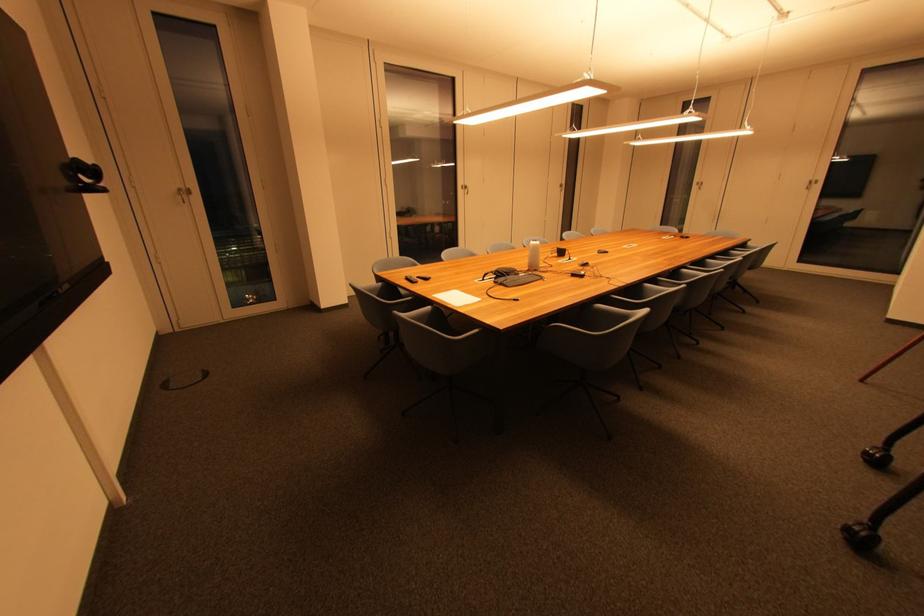
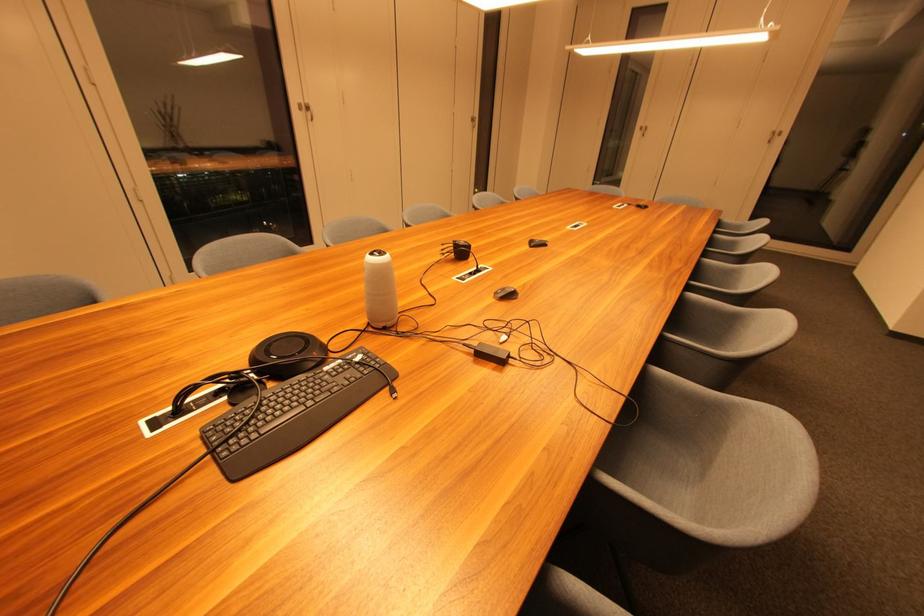
Find the pixel in the second image that matches point 590,267 in the first image.

(515, 298)